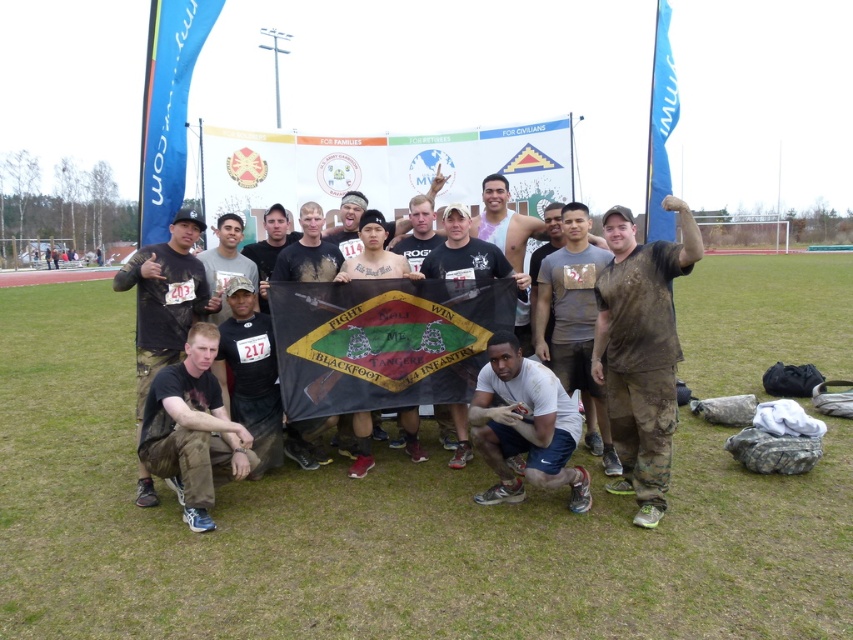
Question: Can you confirm if black matte t-shirt at center is positioned to the left of matte black cap at center?

Choices:
 (A) yes
 (B) no

Answer: (B)

Question: Considering the real-world distances, which object is closest to the black matte t-shirt at center?

Choices:
 (A) dark gray fabric shirt at center
 (B) blue fabric flag at upper left
 (C) muddy t-shirt at center

Answer: (A)

Question: Which point is closer to the camera taking this photo?

Choices:
 (A) pos(445,232)
 (B) pos(120,278)

Answer: (B)

Question: Among these points, which one is nearest to the camera?

Choices:
 (A) (x=314, y=276)
 (B) (x=624, y=356)

Answer: (B)

Question: Does green grass football field at center appear under black matte t-shirt at center?

Choices:
 (A) no
 (B) yes

Answer: (A)

Question: Is dark gray fabric shirt at center thinner than shiny metallic tank top at center?

Choices:
 (A) no
 (B) yes

Answer: (B)